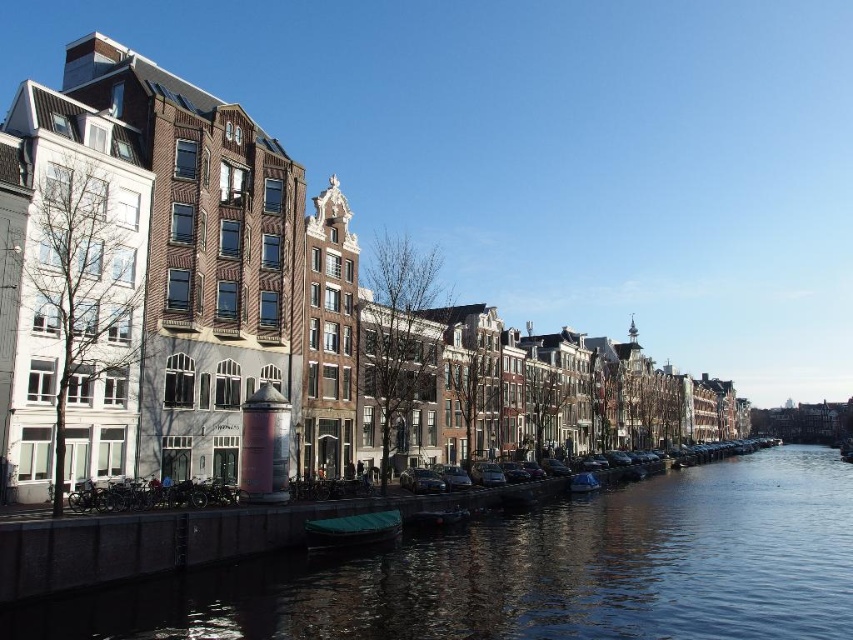
Question: Is smooth concrete water at center positioned in front of blue plastic boat at lower center?

Choices:
 (A) no
 (B) yes

Answer: (B)

Question: Which of the following is the closest to the observer?

Choices:
 (A) blue plastic boat at lower center
 (B) smooth concrete water at center

Answer: (B)

Question: Which point is closer to the camera?

Choices:
 (A) blue plastic boat at lower center
 (B) smooth concrete water at center

Answer: (B)

Question: Can you confirm if green matte boat at lower center is positioned to the left of blue plastic boat at lower center?

Choices:
 (A) no
 (B) yes

Answer: (B)

Question: Based on their relative distances, which object is nearer to the blue plastic boat at lower center?

Choices:
 (A) smooth concrete water at center
 (B) green matte boat at lower center

Answer: (A)

Question: Does smooth concrete water at center lie in front of green matte boat at lower center?

Choices:
 (A) no
 (B) yes

Answer: (B)